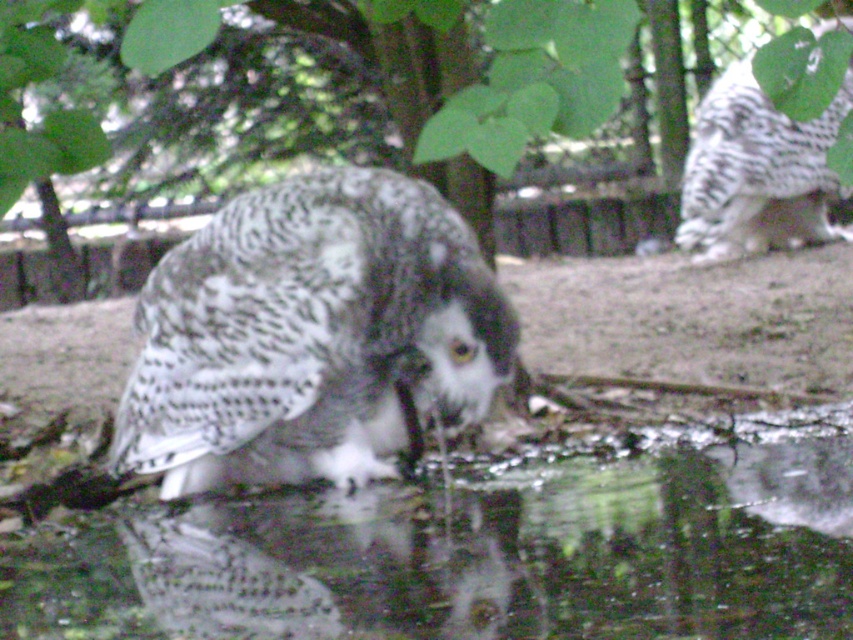
Which is above, clear water at lower center or green leafy tree at center?

green leafy tree at center

Is clear water at lower center positioned before green leafy tree at center?

Yes, it is.

Is point (138, 621) positioned in front of point (579, 61)?

No, it is not.

This screenshot has width=853, height=640. I want to click on clear water at lower center, so coord(482,554).

Does clear water at lower center appear under white speckled owl at upper right?

Correct, clear water at lower center is located below white speckled owl at upper right.

Does point (587, 508) come behind point (758, 125)?

No, it is not.

Where is `clear water at lower center`? clear water at lower center is located at coordinates (482, 554).

Can you confirm if clear water at lower center is taller than speckled feathered owl at center?

In fact, clear water at lower center may be shorter than speckled feathered owl at center.

Can you confirm if clear water at lower center is positioned below speckled feathered owl at center?

Correct, clear water at lower center is located below speckled feathered owl at center.

Is point (143, 628) closer to camera compared to point (332, 464)?

Yes, it is in front of point (332, 464).

Find the location of a particular element. Image resolution: width=853 pixels, height=640 pixels. clear water at lower center is located at coordinates (482, 554).